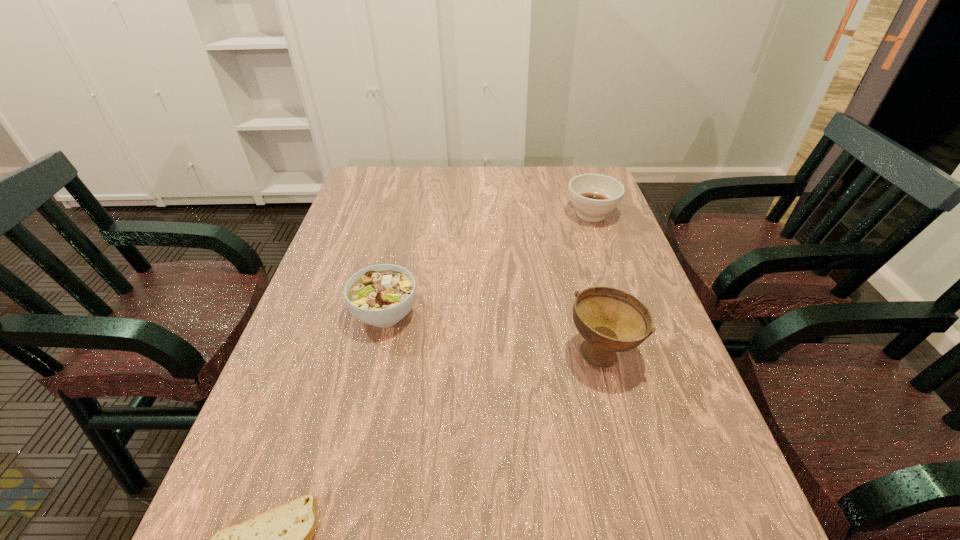
You are a GUI agent. You are given a task and a screenshot of the screen. Output one action in this format:
    pyautogui.click(x=<x>, y=<y>)
    Task: Click on the free space at the left edge of the desktop
    This screenshot has width=960, height=540.
    Given the screenshot: What is the action you would take?
    pyautogui.click(x=333, y=241)

In the image, there is a desktop. Find the location of `free space at the right edge`. free space at the right edge is located at coordinates (617, 218).

At what (x,y) coordinates should I click in order to perform the action: click on blank space at the far right corner. Please return your answer as a coordinate pair (x, y). Looking at the image, I should click on (580, 173).

Where is `empty space between the leftmost soup bowl and the tallest soup bowl`? The width and height of the screenshot is (960, 540). empty space between the leftmost soup bowl and the tallest soup bowl is located at coordinates (493, 333).

Locate an element on the screen. The height and width of the screenshot is (540, 960). vacant area that lies between the tallest soup bowl and the farthest object is located at coordinates (597, 284).

You are a GUI agent. You are given a task and a screenshot of the screen. Output one action in this format:
    pyautogui.click(x=<x>, y=<y>)
    Task: Click on the free space between the leftmost soup bowl and the farthest soup bowl
    This screenshot has height=540, width=960.
    Given the screenshot: What is the action you would take?
    pyautogui.click(x=489, y=264)

I want to click on free point between the farthest object and the leftmost soup bowl, so click(x=489, y=264).

This screenshot has width=960, height=540. Find the location of `vacant area that lies between the tallest object and the leftmost soup bowl`. vacant area that lies between the tallest object and the leftmost soup bowl is located at coordinates (493, 333).

This screenshot has width=960, height=540. Find the location of `blank region between the farthest object and the tallest soup bowl`. blank region between the farthest object and the tallest soup bowl is located at coordinates (597, 284).

The width and height of the screenshot is (960, 540). Find the location of `vacant point located between the leftmost soup bowl and the tallest soup bowl`. vacant point located between the leftmost soup bowl and the tallest soup bowl is located at coordinates (493, 333).